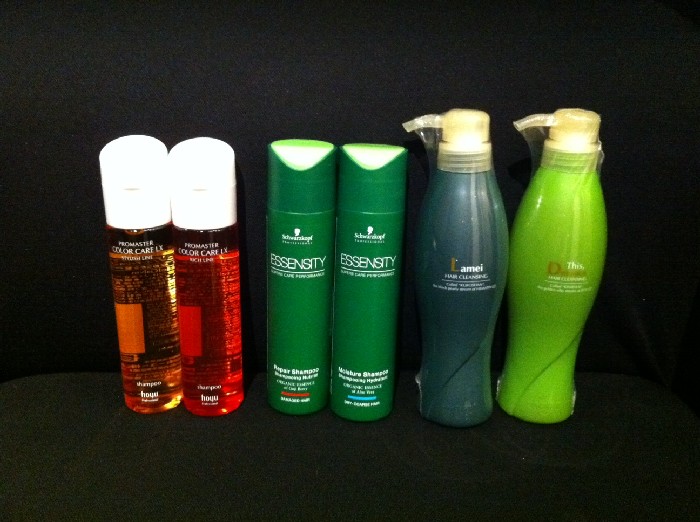
Find the location of `bottle`. bottle is located at coordinates (147, 310), (216, 310), (304, 314), (371, 331), (444, 311), (526, 340).